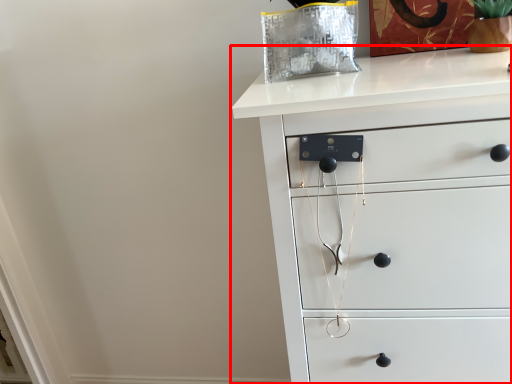
Question: From the image's perspective, considering the relative positions of chest of drawers (annotated by the red box) and glass vase in the image provided, where is chest of drawers (annotated by the red box) located with respect to the staircase?

Choices:
 (A) below
 (B) above

Answer: (A)